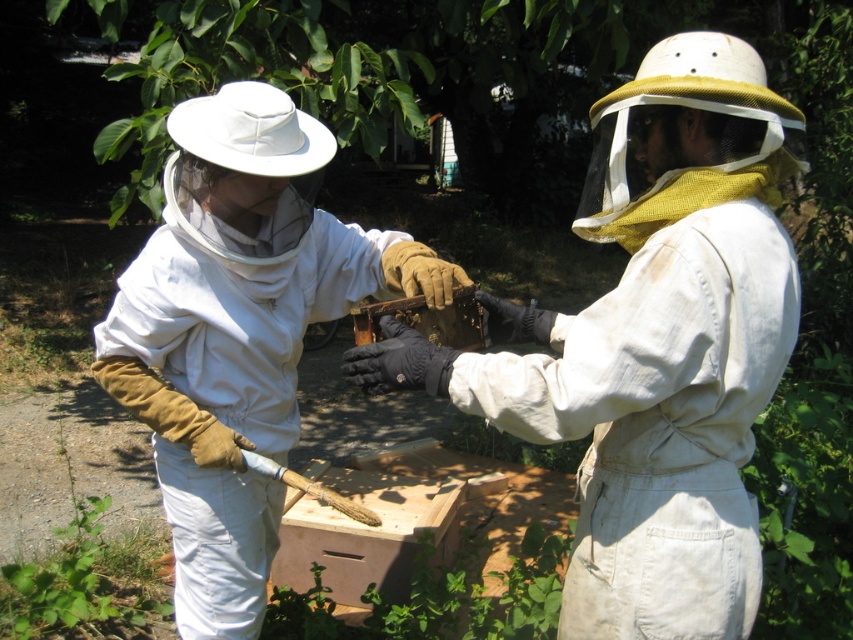
You are a beekeeper trying to retrieve honey from the wooden honeycomb at center. You need to move the white matte beekeeper suit at center out of the way. Which direction should you move it to avoid blocking access to the honeycomb?

The white matte beekeeper suit at center is positioned on the left side of the wooden honeycomb at center, so you should move it to the right to avoid blocking access to the honeycomb.

From the picture: You are standing at the origin point in the center of the image. There are two points marked in the scene, one at point coordinates point (160, 320) and another at point coordinates point (463, 317). If you want to reach the point that is behind the other, which coordinate should you go to?

The point at coordinates point (160, 320) is behind point (463, 317). Therefore, if you want to reach the point that is behind the other, you should go to point (160, 320).

You are a beekeeper trying to identify which beekeeper suit is closer to you. You see two beekeeper suits at the center, one labeled as white cotton beekeeper suit at center and the other as white matte beekeeper suit at center. Which one is closer to you?

The white cotton beekeeper suit at center is closer to you because it is in front of the white matte beekeeper suit at center.